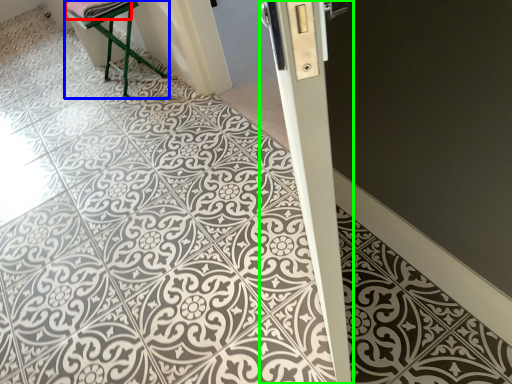
Question: Based on their relative distances, which object is nearer to material (highlighted by a red box)? Choose from furniture (highlighted by a blue box) and pillar (highlighted by a green box).

Choices:
 (A) furniture
 (B) pillar

Answer: (A)